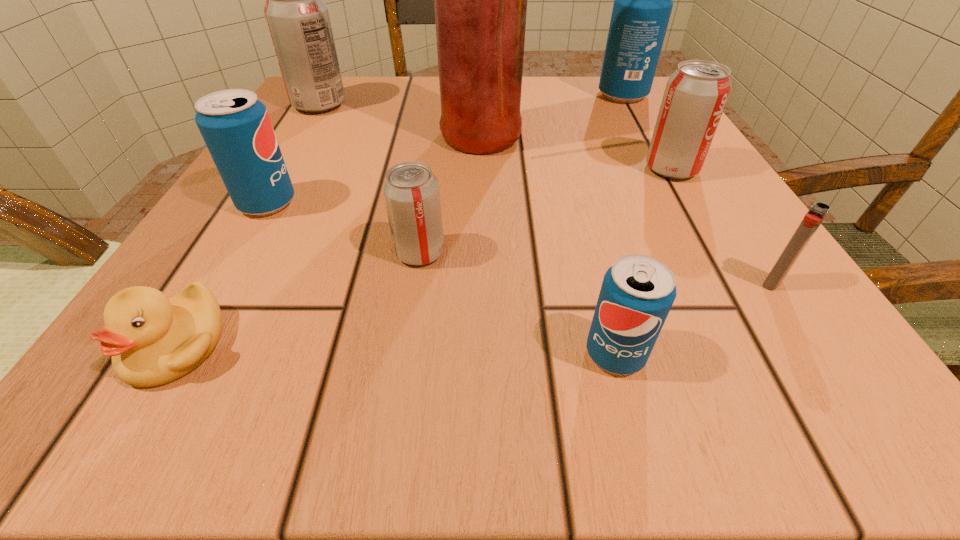
I want to click on vacant point located 0.120m on the left of the rightmost gray soda can, so click(569, 169).

You are a GUI agent. You are given a task and a screenshot of the screen. Output one action in this format:
    pyautogui.click(x=<x>, y=<y>)
    Task: Click on the free location located on the right of the third nearest soda can
    
    Given the screenshot: What is the action you would take?
    pyautogui.click(x=372, y=203)

The image size is (960, 540). Identify the location of free space located on the left of the fourth soda can from left to right. (517, 354).

Where is `vacant space located 0.150m on the back of the smallest gray soda can`? vacant space located 0.150m on the back of the smallest gray soda can is located at coordinates (431, 176).

Identify the location of free spot located 0.120m on the left of the third nearest object. This screenshot has height=540, width=960. tap(660, 283).

Locate an element on the screen. The height and width of the screenshot is (540, 960). fire extinguisher that is at the far edge is located at coordinates (480, 0).

Identify the location of soda can at the near edge. This screenshot has height=540, width=960. (638, 291).

The width and height of the screenshot is (960, 540). Identify the location of duckling situated at the near edge. (153, 340).

Identify the location of duckling present at the left edge. (153, 340).

You are a GUI agent. You are given a task and a screenshot of the screen. Output one action in this format:
    pyautogui.click(x=<x>, y=<y>)
    Task: Click on the igniter present at the right edge
    The height and width of the screenshot is (540, 960).
    Given the screenshot: What is the action you would take?
    pyautogui.click(x=818, y=211)